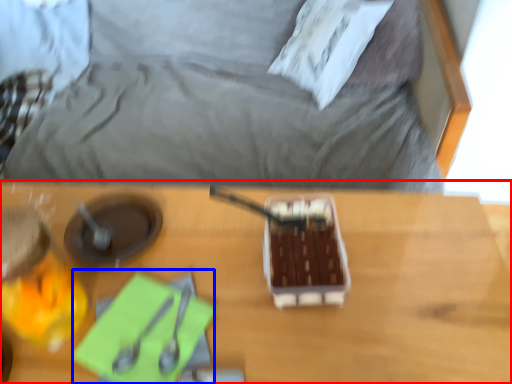
Question: Which object is further to the camera taking this photo, table (highlighted by a red box) or notepad (highlighted by a blue box)?

Choices:
 (A) table
 (B) notepad

Answer: (B)